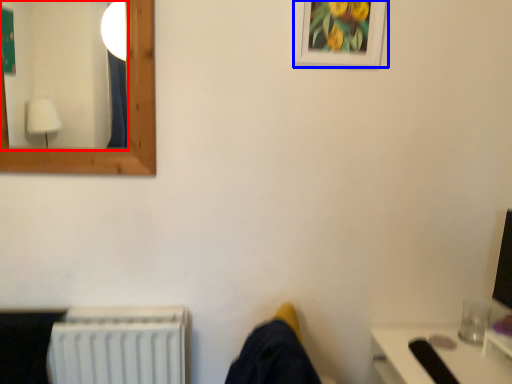
Question: Among these objects, which one is nearest to the camera, mirror (highlighted by a red box) or picture frame (highlighted by a blue box)?

Choices:
 (A) mirror
 (B) picture frame

Answer: (A)